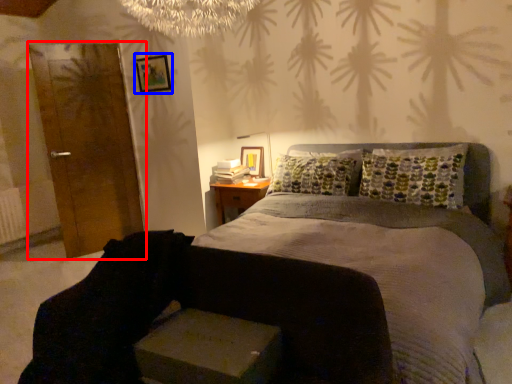
Question: Which of the following is the farthest to the observer, armoire (highlighted by a red box) or picture frame (highlighted by a blue box)?

Choices:
 (A) armoire
 (B) picture frame

Answer: (B)